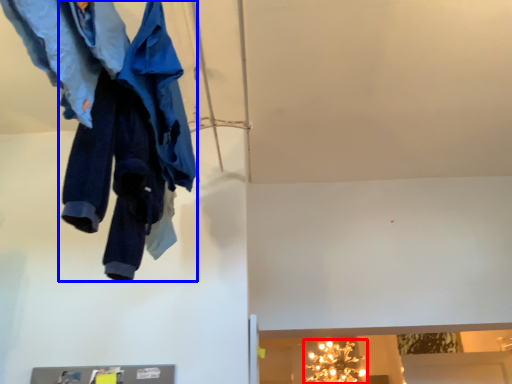
Question: Which of the following is the farthest to the observer, light fixture (highlighted by a red box) or trousers (highlighted by a blue box)?

Choices:
 (A) light fixture
 (B) trousers

Answer: (A)